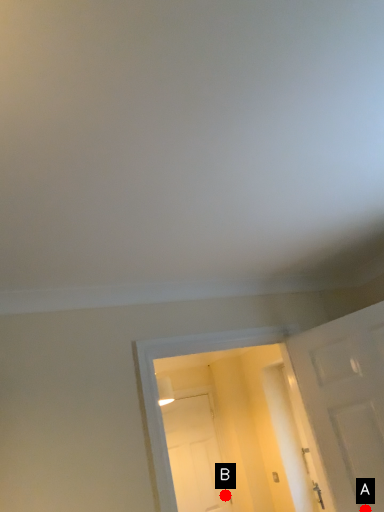
Question: Two points are circled on the image, labeled by A and B beside each circle. Which of the following is the closest to the observer?

Choices:
 (A) A is closer
 (B) B is closer

Answer: (A)